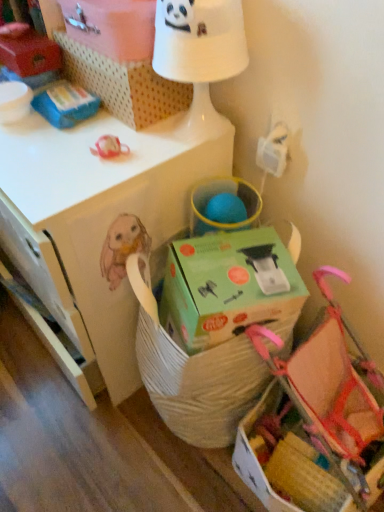
Find the location of a particular element. Image resolution: width=384 pixels, height=512 pixels. vacant region in front of white cardboard box at upper center, which is the first storage box in right-to-left order is located at coordinates (87, 157).